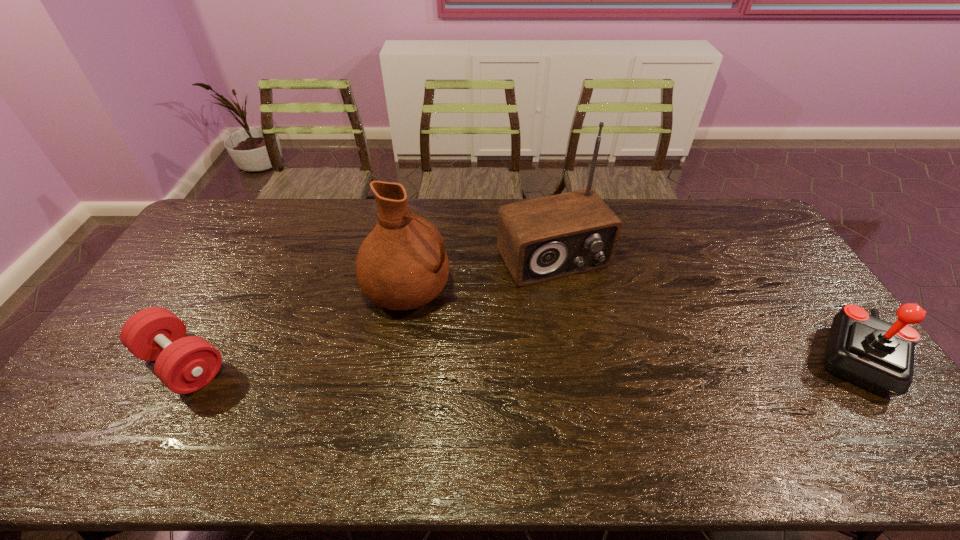
You are a GUI agent. You are given a task and a screenshot of the screen. Output one action in this format:
    pyautogui.click(x=<x>, y=<y>)
    Task: Click on the blank region between the shortest object and the radio receiver
    The height and width of the screenshot is (540, 960).
    Given the screenshot: What is the action you would take?
    pyautogui.click(x=368, y=311)

At what (x,y) coordinates should I click in order to perform the action: click on free spot between the rightmost object and the third object from left to right. Please return your answer as a coordinate pair (x, y). Looking at the image, I should click on (706, 308).

Where is `vacant space in between the pitcher and the third tallest object`? vacant space in between the pitcher and the third tallest object is located at coordinates (632, 323).

At what (x,y) coordinates should I click in order to perform the action: click on free spot between the shortest object and the third object from right to left. Please return your answer as a coordinate pair (x, y). Looking at the image, I should click on (295, 326).

Where is `unoccupied position between the rightmost object and the third object from right to left`? The image size is (960, 540). unoccupied position between the rightmost object and the third object from right to left is located at coordinates (632, 323).

Identify the location of vacant point located between the pitcher and the leftmost object. (295, 326).

This screenshot has width=960, height=540. Find the location of `object that is the closest to the radio receiver`. object that is the closest to the radio receiver is located at coordinates (401, 265).

Point out which object is positioned as the nearest to the leftmost object. Please provide its 2D coordinates. Your answer should be formatted as a tuple, i.e. [(x, y)], where the tuple contains the x and y coordinates of a point satisfying the conditions above.

[(401, 265)]

I want to click on free region that satisfies the following two spatial constraints: 1. on the front side of the second tallest object; 2. on the left side of the joystick, so click(396, 358).

The width and height of the screenshot is (960, 540). What are the coordinates of `vacant space that satisfies the following two spatial constraints: 1. on the front side of the rightmost object; 2. on the left side of the third shortest object` in the screenshot? It's located at 396,358.